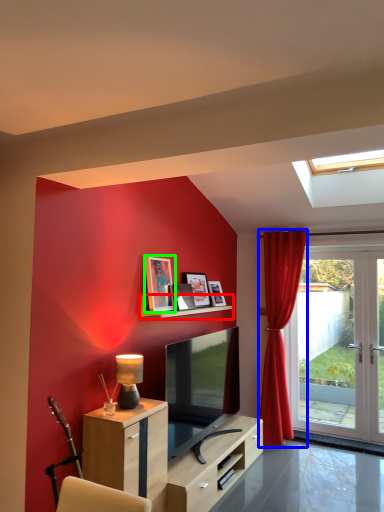
Question: Which is nearer to the shelf (highlighted by a red box)? curtain (highlighted by a blue box) or picture frame (highlighted by a green box).

Choices:
 (A) curtain
 (B) picture frame

Answer: (B)